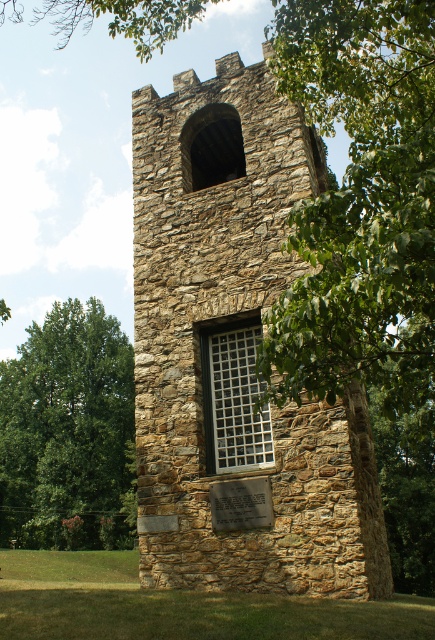
Question: Can you confirm if brown stone tower at center is positioned above silver metallic plaque at lower center?

Choices:
 (A) no
 (B) yes

Answer: (B)

Question: Can you confirm if green leafy tree at left is positioned to the left of white grid glass at center?

Choices:
 (A) no
 (B) yes

Answer: (B)

Question: Is brown stone tower at center to the right of silver metallic plaque at lower center from the viewer's perspective?

Choices:
 (A) no
 (B) yes

Answer: (A)

Question: Which point is farther from the camera taking this photo?

Choices:
 (A) (54, 429)
 (B) (240, 540)
 (C) (217, 483)
 (D) (237, 380)

Answer: (A)

Question: Which is nearer to the silver metallic plaque at lower center?

Choices:
 (A) green leafy tree at left
 (B) brown stone tower at center
 (C) white grid glass at center

Answer: (C)

Question: Which of the following is the closest to the observer?

Choices:
 (A) (121, 509)
 (B) (263, 497)
 (C) (230, 381)
 (D) (163, 192)

Answer: (B)